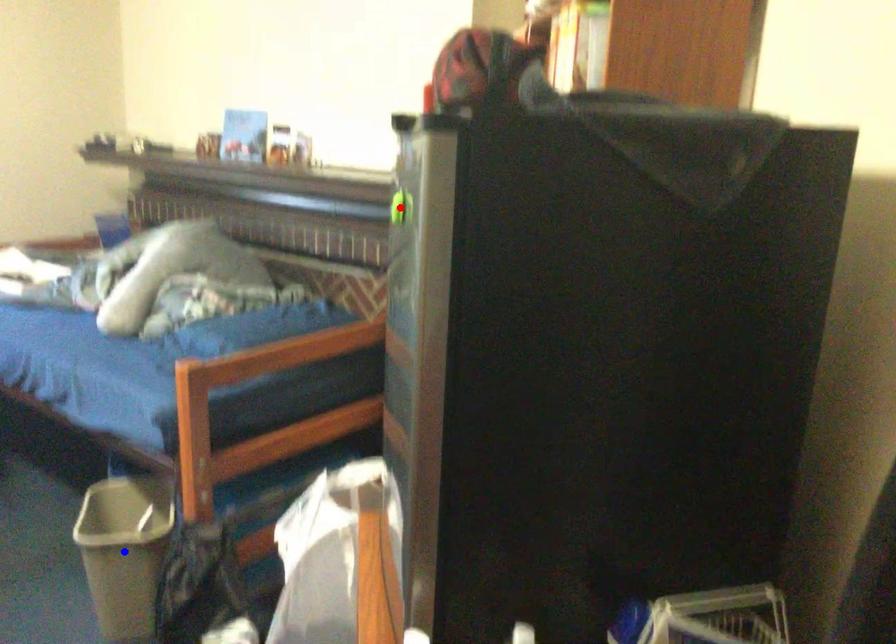
Question: In the image, two points are highlighted. Which point is nearer to the camera? Reply with the corresponding letter.

Choices:
 (A) blue point
 (B) red point

Answer: (B)